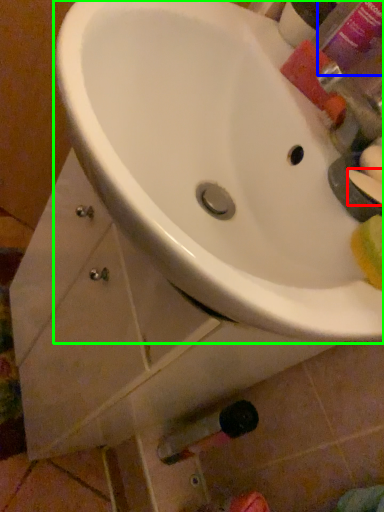
Question: Which object is positioned closest to soap (highlighted by a red box)? Select from mouthwash (highlighted by a blue box) and sink (highlighted by a green box).

Choices:
 (A) mouthwash
 (B) sink

Answer: (B)